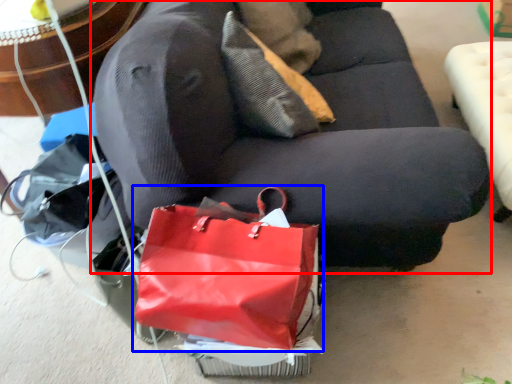
Question: Which object appears farthest to the camera in this image, studio couch (highlighted by a red box) or handbag (highlighted by a blue box)?

Choices:
 (A) studio couch
 (B) handbag

Answer: (B)